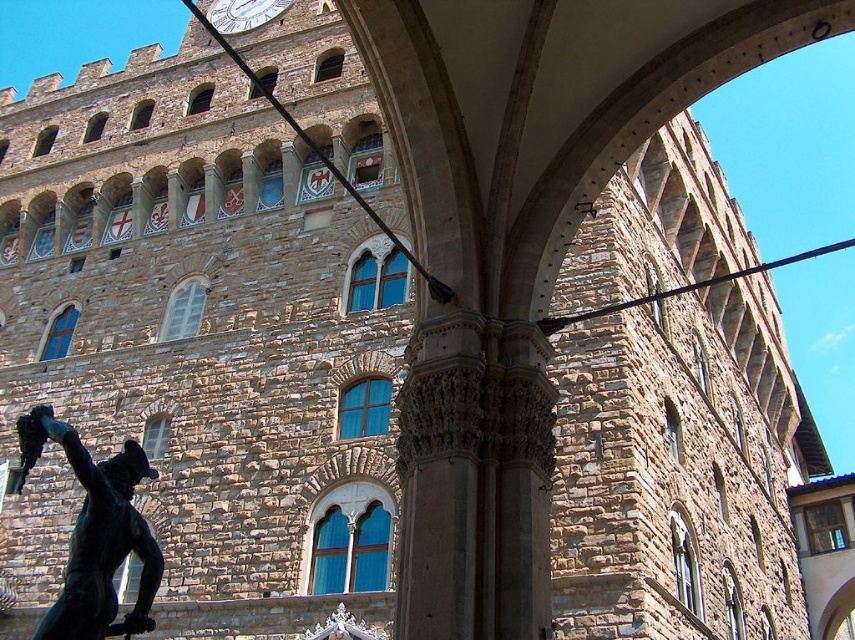
Question: In this image, where is green patina bronze statue at lower left located relative to white glossy clock at upper center?

Choices:
 (A) above
 (B) below

Answer: (B)

Question: Is green patina bronze statue at lower left to the right of white glossy clock at upper center from the viewer's perspective?

Choices:
 (A) yes
 (B) no

Answer: (B)

Question: Which object appears closest to the camera in this image?

Choices:
 (A) white glossy clock at upper center
 (B) green patina bronze statue at lower left

Answer: (B)

Question: From the image, what is the correct spatial relationship of green patina bronze statue at lower left in relation to white glossy clock at upper center?

Choices:
 (A) above
 (B) below

Answer: (B)